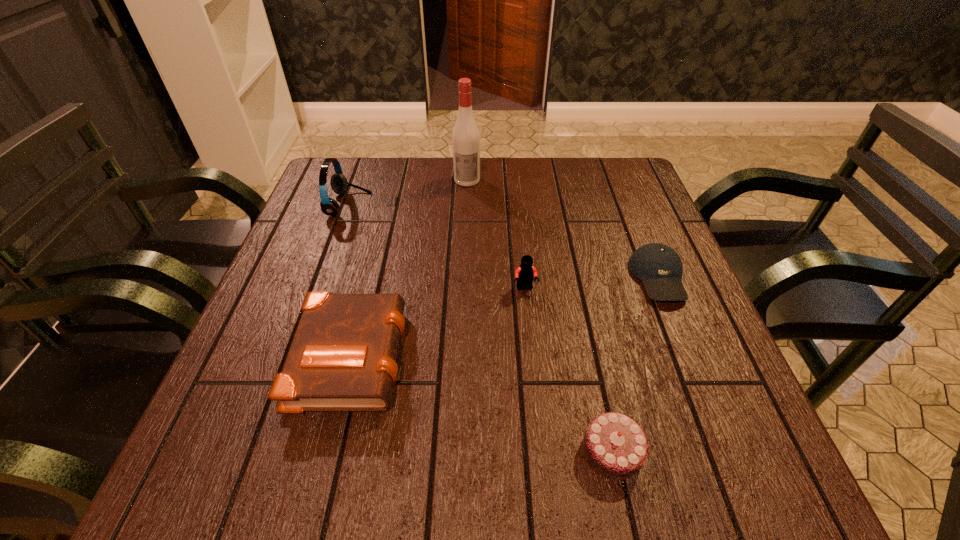
Where is `Bible that is at the left edge`? This screenshot has height=540, width=960. Bible that is at the left edge is located at coordinates (343, 356).

Locate an element on the screen. This screenshot has width=960, height=540. object that is positioned at the right edge is located at coordinates (658, 266).

Where is `object that is positioned at the far left corner`? object that is positioned at the far left corner is located at coordinates (339, 184).

In the image, there is a desktop. At what (x,y) coordinates should I click in order to perform the action: click on vacant space at the far edge. Please return your answer as a coordinate pair (x, y). Looking at the image, I should click on (493, 175).

Where is `vacant space at the near edge of the desktop`? vacant space at the near edge of the desktop is located at coordinates (357, 474).

In order to click on vacant region at the left edge of the desktop in this screenshot , I will do `click(266, 298)`.

Locate an element on the screen. This screenshot has width=960, height=540. vacant space at the right edge of the desktop is located at coordinates (617, 284).

In the image, there is a desktop. Identify the location of vacant region at the far left corner. (362, 171).

Where is `vacant region at the near left corner of the desktop`? This screenshot has width=960, height=540. vacant region at the near left corner of the desktop is located at coordinates (251, 475).

What are the coordinates of `vacant space at the far right corner of the desktop` in the screenshot? It's located at (600, 170).